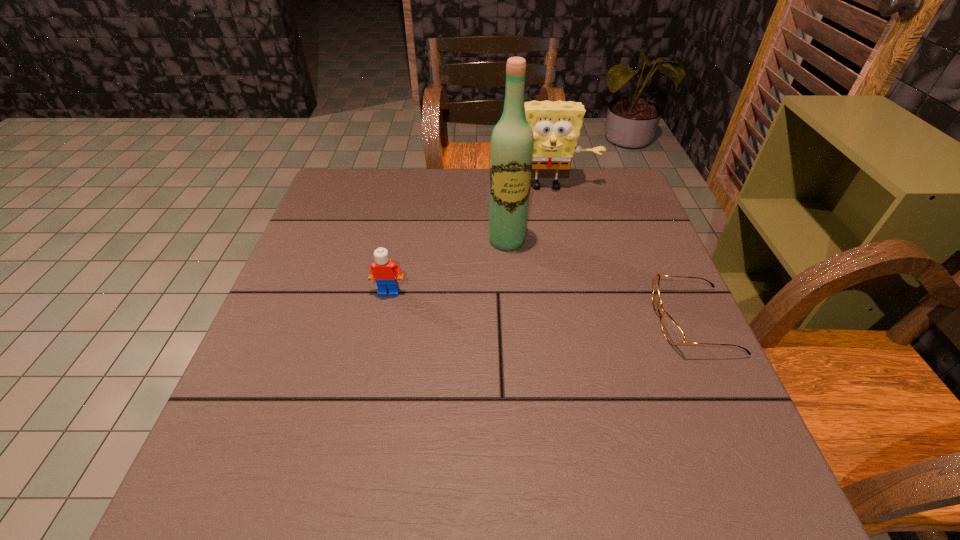
You are a GUI agent. You are given a task and a screenshot of the screen. Output one action in this format:
    pyautogui.click(x=<x>, y=<y>)
    Task: Click on the vacant space in between the third shortest object and the spectacles
    This screenshot has height=540, width=960.
    Given the screenshot: What is the action you would take?
    pyautogui.click(x=619, y=253)

Locate an element on the screen. The height and width of the screenshot is (540, 960). unoccupied position between the shortest object and the wine bottle is located at coordinates (600, 280).

The height and width of the screenshot is (540, 960). I want to click on vacant space that is in between the shortest object and the farthest object, so click(619, 253).

The height and width of the screenshot is (540, 960). What are the coordinates of `empty location between the tallest object and the Lego` in the screenshot? It's located at (448, 266).

At what (x,y) coordinates should I click in order to perform the action: click on empty space that is in between the shortest object and the second farthest object. Please return your answer as a coordinate pair (x, y). Looking at the image, I should click on (600, 280).

Where is `free area in between the tallest object and the spectacles`? The width and height of the screenshot is (960, 540). free area in between the tallest object and the spectacles is located at coordinates (600, 280).

At what (x,y) coordinates should I click in order to perform the action: click on empty location between the shortest object and the leftmost object. Please return your answer as a coordinate pair (x, y). The width and height of the screenshot is (960, 540). Looking at the image, I should click on (541, 306).

Locate an element on the screen. free space between the spectacles and the tallest object is located at coordinates (600, 280).

Find the location of `free spot between the sponge and the shortest object`. free spot between the sponge and the shortest object is located at coordinates (619, 253).

Identify which object is located as the third nearest to the third tallest object. Please provide its 2D coordinates. Your answer should be formatted as a tuple, i.e. [(x, y)], where the tuple contains the x and y coordinates of a point satisfying the conditions above.

[(674, 334)]